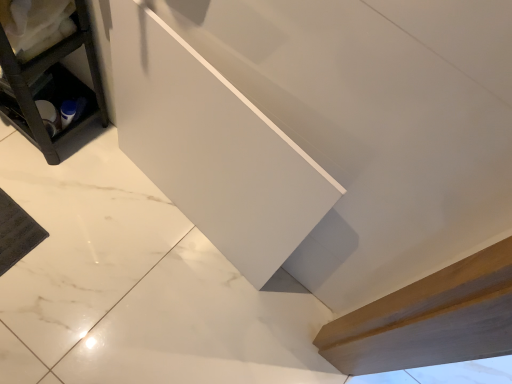
Describe the element at coordinates (50, 81) in the screenshot. I see `metallic gray shelf at left` at that location.

In the scene shown: What is the approximate width of metallic gray shelf at left?

11.26 inches.

At what (x,y) coordinates should I click in order to perform the action: click on metallic gray shelf at left. Please return your answer as a coordinate pair (x, y). This screenshot has height=384, width=512. Looking at the image, I should click on (50, 81).

You are a GUI agent. You are given a task and a screenshot of the screen. Output one action in this format:
    pyautogui.click(x=<x>, y=<y>)
    Task: Click on the metallic gray shelf at left
    Image resolution: width=512 pixels, height=384 pixels.
    Given the screenshot: What is the action you would take?
    pyautogui.click(x=50, y=81)